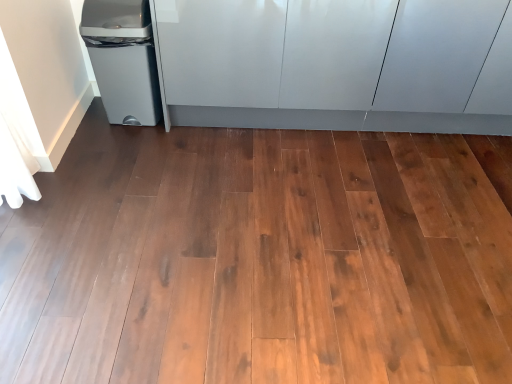
Question: Would you say matte gray plastic trash can at left is a long distance from white fabric curtain at left?

Choices:
 (A) no
 (B) yes

Answer: (A)

Question: Is matte gray plastic trash can at left touching white fabric curtain at left?

Choices:
 (A) yes
 (B) no

Answer: (B)

Question: Can you confirm if matte gray plastic trash can at left is thinner than white fabric curtain at left?

Choices:
 (A) yes
 (B) no

Answer: (B)

Question: Does matte gray plastic trash can at left have a lesser height compared to white fabric curtain at left?

Choices:
 (A) no
 (B) yes

Answer: (B)

Question: Does matte gray plastic trash can at left have a greater height compared to white fabric curtain at left?

Choices:
 (A) no
 (B) yes

Answer: (A)

Question: Is matte gray plastic trash can at left looking in the opposite direction of white fabric curtain at left?

Choices:
 (A) no
 (B) yes

Answer: (A)

Question: Can you confirm if matte gray plastic trash can at left is smaller than glossy white cabinetry at upper center?

Choices:
 (A) yes
 (B) no

Answer: (A)

Question: Could you tell me if matte gray plastic trash can at left is turned towards glossy white cabinetry at upper center?

Choices:
 (A) yes
 (B) no

Answer: (B)

Question: Would you consider matte gray plastic trash can at left to be distant from glossy white cabinetry at upper center?

Choices:
 (A) no
 (B) yes

Answer: (A)

Question: Is matte gray plastic trash can at left facing away from glossy white cabinetry at upper center?

Choices:
 (A) yes
 (B) no

Answer: (B)

Question: Can you confirm if matte gray plastic trash can at left is positioned to the right of glossy white cabinetry at upper center?

Choices:
 (A) yes
 (B) no

Answer: (B)

Question: Is the depth of matte gray plastic trash can at left less than that of glossy white cabinetry at upper center?

Choices:
 (A) no
 (B) yes

Answer: (A)

Question: Considering the relative positions of glossy white cabinetry at upper center and matte gray plastic trash can at left in the image provided, is glossy white cabinetry at upper center to the left of matte gray plastic trash can at left from the viewer's perspective?

Choices:
 (A) yes
 (B) no

Answer: (B)